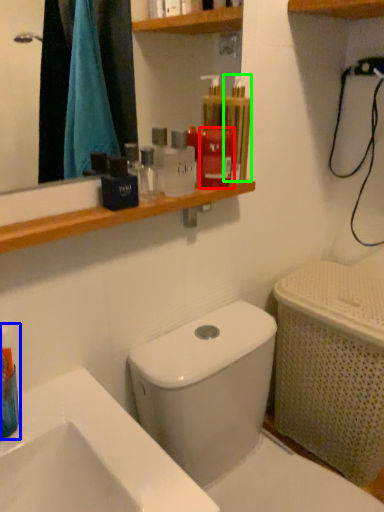
Question: Considering the real-world distances, which object is farthest from mouthwash (highlighted by a red box)? mouthwash (highlighted by a blue box) or mouthwash (highlighted by a green box)?

Choices:
 (A) mouthwash
 (B) mouthwash

Answer: (A)